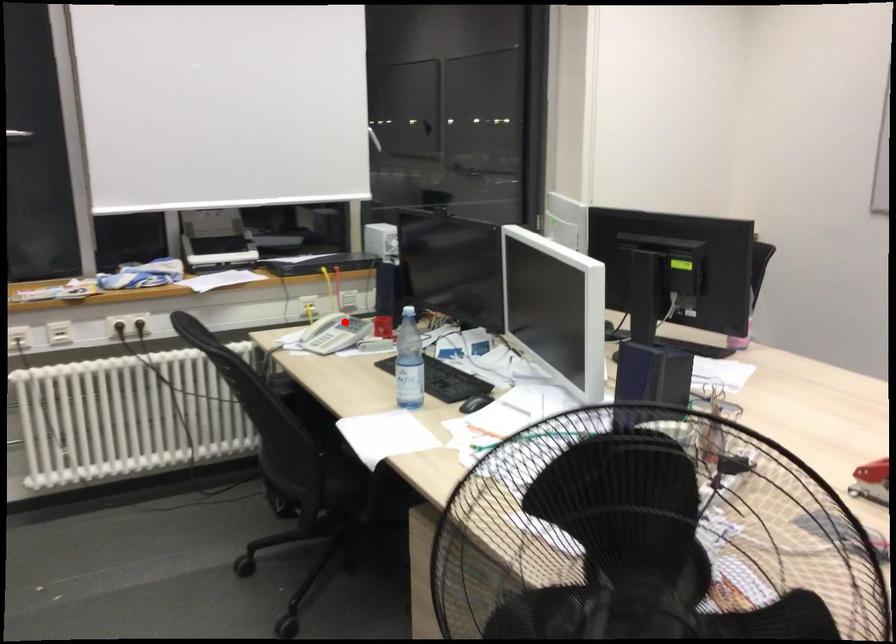
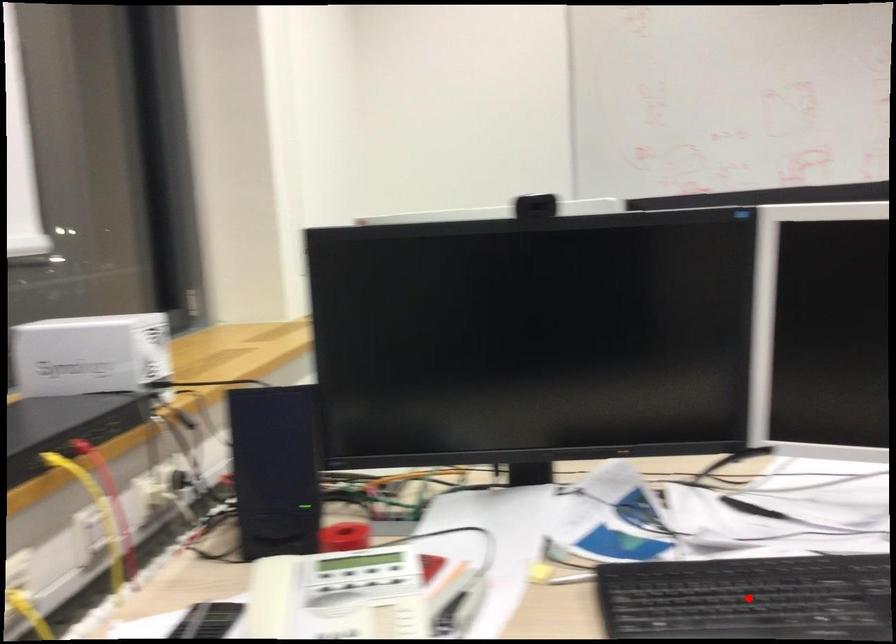
I am providing you with two images of the same scene from different viewpoints. A red point is marked on the first image and another point is marked on the second image. Does the point marked in image1 correspond to the same location as the one in image2?

No